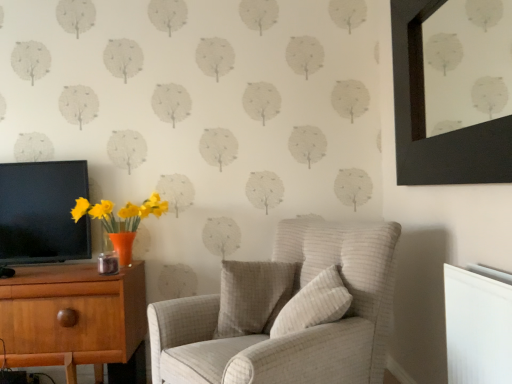
Identify the location of free space in front of black glossy tv at left. (39, 265).